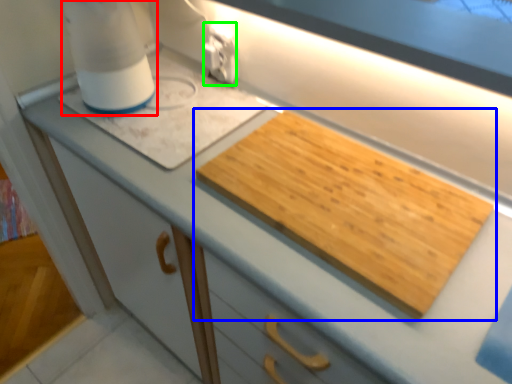
Question: Which is farther away from blender (highlighted by a red box)? cutting board (highlighted by a blue box) or electric outlet (highlighted by a green box)?

Choices:
 (A) cutting board
 (B) electric outlet

Answer: (A)